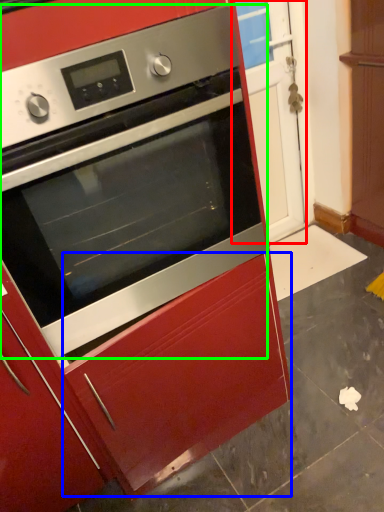
Question: Estimate the real-world distances between objects in this image. Which object is farther from glass door (highlighted by a red box), drawer (highlighted by a blue box) or oven (highlighted by a green box)?

Choices:
 (A) drawer
 (B) oven

Answer: (A)